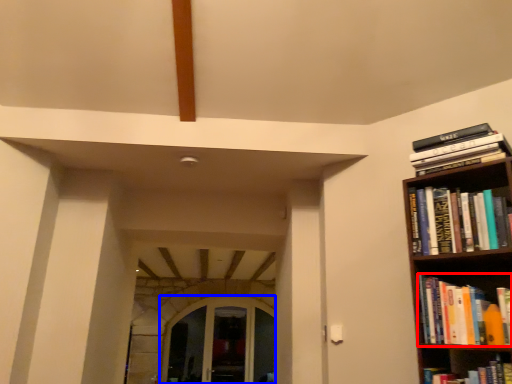
Question: Which point is further to the camera, book (highlighted by a red box) or glass door (highlighted by a blue box)?

Choices:
 (A) book
 (B) glass door

Answer: (B)